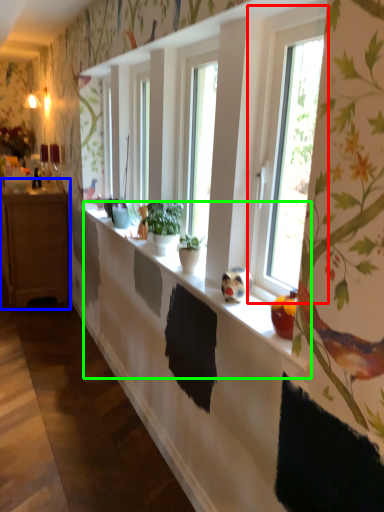
Question: Which object is positioned farthest from window (highlighted by a red box)? Select from cabinetry (highlighted by a blue box) and window sill (highlighted by a green box).

Choices:
 (A) cabinetry
 (B) window sill

Answer: (A)